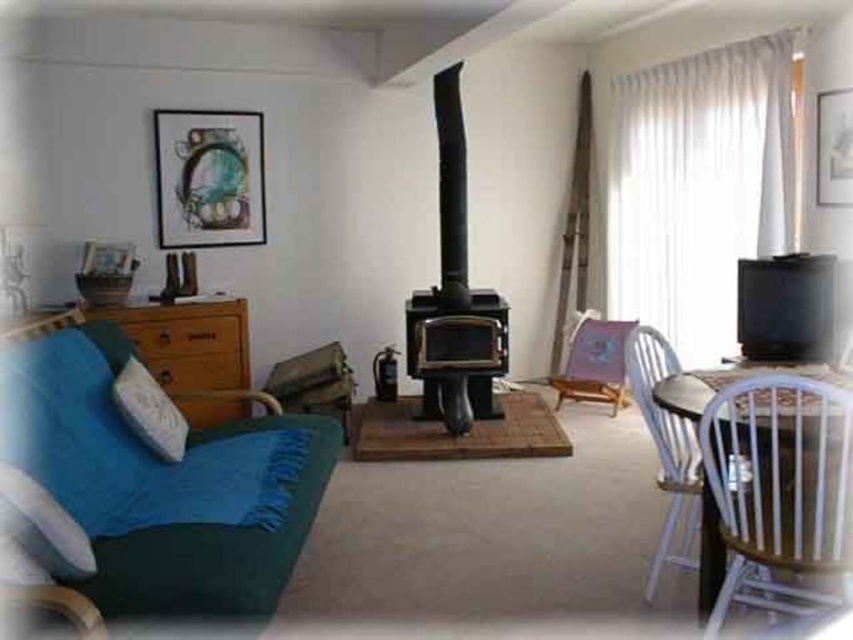
Question: Is wooden spindle back chair at right bigger than wooden folding chair at center?

Choices:
 (A) no
 (B) yes

Answer: (B)

Question: Which object is closer to the camera taking this photo?

Choices:
 (A) white soft pillow at left
 (B) matte black picture frame at upper right
 (C) metallic silver picture frame at upper left
 (D) white soft pillow at lower left

Answer: (D)

Question: Which point is farther to the camera?

Choices:
 (A) (711, 568)
 (B) (228, 170)

Answer: (B)

Question: Is white soft pillow at left closer to the viewer compared to matte black picture frame at upper right?

Choices:
 (A) yes
 (B) no

Answer: (A)

Question: Which of the following is the closest to the observer?

Choices:
 (A) wooden folding chair at center
 (B) metallic silver picture frame at upper left
 (C) matte black picture frame at upper right
 (D) blue fabric couch at left

Answer: (D)

Question: Can you confirm if wooden spindle back chair at right is positioned to the left of white soft pillow at left?

Choices:
 (A) yes
 (B) no

Answer: (B)